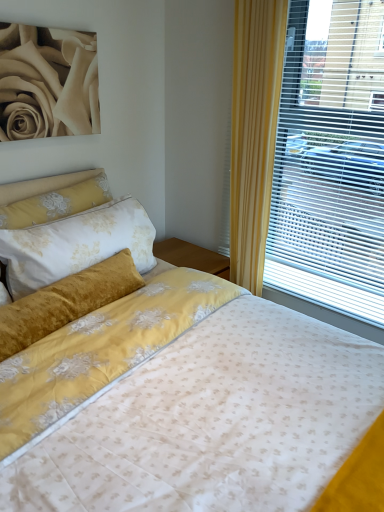
Question: Considering the relative sizes of matte cream rose at upper left and matte blinds at right in the image provided, is matte cream rose at upper left taller than matte blinds at right?

Choices:
 (A) no
 (B) yes

Answer: (A)

Question: Does matte cream rose at upper left have a larger size compared to matte blinds at right?

Choices:
 (A) no
 (B) yes

Answer: (A)

Question: Can you confirm if matte cream rose at upper left is positioned to the left of matte blinds at right?

Choices:
 (A) no
 (B) yes

Answer: (B)

Question: From the image's perspective, is matte cream rose at upper left beneath matte blinds at right?

Choices:
 (A) no
 (B) yes

Answer: (A)

Question: Is matte cream rose at upper left aimed at matte blinds at right?

Choices:
 (A) yes
 (B) no

Answer: (B)

Question: Looking at the image, does matte cream rose at upper left seem bigger or smaller compared to velvet yellow pillow at upper left?

Choices:
 (A) small
 (B) big

Answer: (A)

Question: Relative to velvet yellow pillow at upper left, is matte cream rose at upper left in front or behind?

Choices:
 (A) front
 (B) behind

Answer: (A)

Question: Looking at their shapes, would you say matte cream rose at upper left is wider or thinner than velvet yellow pillow at upper left?

Choices:
 (A) wide
 (B) thin

Answer: (B)

Question: Is matte cream rose at upper left inside the boundaries of velvet yellow pillow at upper left, or outside?

Choices:
 (A) outside
 (B) inside

Answer: (A)

Question: Does point (301, 74) appear closer or farther from the camera than point (94, 187)?

Choices:
 (A) closer
 (B) farther

Answer: (A)

Question: Is matte blinds at right wider or thinner than velvet yellow pillow at upper left?

Choices:
 (A) wide
 (B) thin

Answer: (B)

Question: From a real-world perspective, relative to velvet yellow pillow at upper left, is matte blinds at right vertically above or below?

Choices:
 (A) below
 (B) above

Answer: (B)

Question: In terms of height, does matte blinds at right look taller or shorter compared to velvet yellow pillow at upper left?

Choices:
 (A) short
 (B) tall

Answer: (B)

Question: From a real-world perspective, is velvet yellow pillow at upper left above or below matte blinds at right?

Choices:
 (A) above
 (B) below

Answer: (B)

Question: Considering the positions of velvet yellow pillow at upper left and matte blinds at right in the image, is velvet yellow pillow at upper left wider or thinner than matte blinds at right?

Choices:
 (A) wide
 (B) thin

Answer: (A)